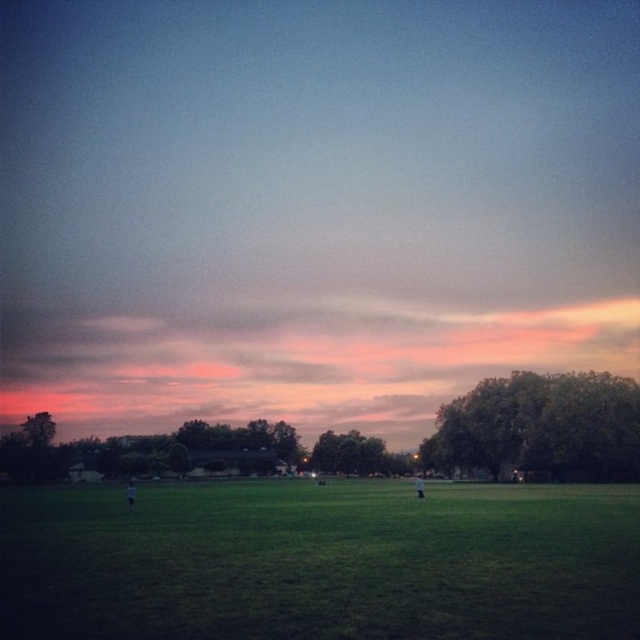
You are a photographer trying to capture the sunset. You notice two items in the scene, the dark gray fabric at center and the white cotton shirt at center. Which item is positioned higher relative to the other?

The dark gray fabric at center is positioned higher than the white cotton shirt at center because it is described as being above it.

You are standing at the edge of a field with a 10 meter long ladder that you need to carry to the green grass at center. Can you carry it horizontally without tilting it? Please explain your reasoning based on the distance between you and the grass.

The distance between you and the green grass at center is 14.05 meters. Since the ladder is only 10 meters long, you can carry it horizontally as the distance is greater than the ladder length, allowing enough space to move without tilting.